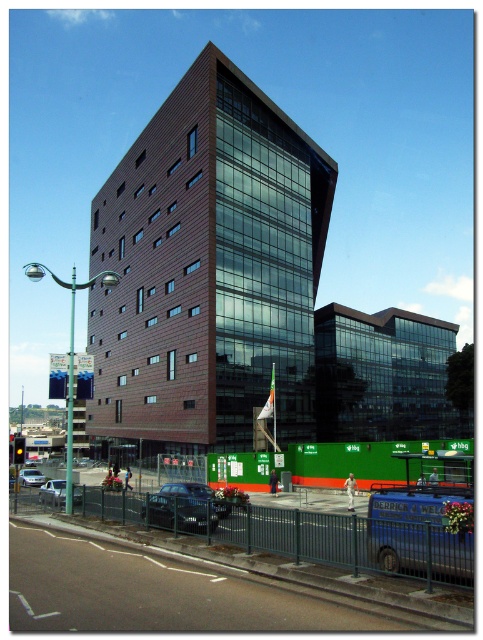
Question: Is shiny black car at center bigger than silver metallic car at center?

Choices:
 (A) yes
 (B) no

Answer: (B)

Question: Is shiny black car at center wider than silver metallic car at lower left?

Choices:
 (A) yes
 (B) no

Answer: (B)

Question: Based on their relative distances, which object is nearer to the silver metallic car at lower left?

Choices:
 (A) silver metallic car at center
 (B) shiny black car at center

Answer: (B)

Question: Among these points, which one is nearest to the camera?

Choices:
 (A) (28, 483)
 (B) (61, 492)
 (C) (184, 525)

Answer: (C)

Question: Which point is farther to the camera?

Choices:
 (A) tap(33, 481)
 (B) tap(207, 499)
 (C) tap(44, 490)

Answer: (A)

Question: Is shiny black car at center to the right of silver metallic car at lower left from the viewer's perspective?

Choices:
 (A) no
 (B) yes

Answer: (B)